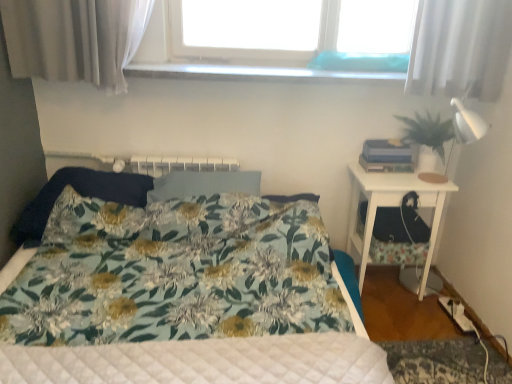
Question: Can you confirm if white glossy nightstand at right is wider than dark blue fabric pillow at left, the first pillow when ordered from left to right?

Choices:
 (A) no
 (B) yes

Answer: (A)

Question: Can you confirm if white glossy nightstand at right is taller than dark blue fabric pillow at left, which appears as the 2th pillow when viewed from the right?

Choices:
 (A) no
 (B) yes

Answer: (B)

Question: Would you say white glossy nightstand at right is a long distance from dark blue fabric pillow at left, which appears as the 2th pillow when viewed from the right?

Choices:
 (A) yes
 (B) no

Answer: (A)

Question: Can dark blue fabric pillow at left, the first pillow when ordered from left to right, be found inside white glossy nightstand at right?

Choices:
 (A) yes
 (B) no

Answer: (B)

Question: From the image's perspective, is white glossy nightstand at right below dark blue fabric pillow at left, which appears as the 2th pillow when viewed from the right?

Choices:
 (A) no
 (B) yes

Answer: (B)

Question: Is fluffy fabric pillow at center, placed as the 2th pillow when sorted from left to right, bigger or smaller than white glossy nightstand at right?

Choices:
 (A) small
 (B) big

Answer: (A)

Question: Based on their positions, is fluffy fabric pillow at center, placed as the 2th pillow when sorted from left to right, located to the left or right of white glossy nightstand at right?

Choices:
 (A) right
 (B) left

Answer: (B)

Question: From the image's perspective, is fluffy fabric pillow at center, which is the first pillow in right-to-left order, positioned above or below white glossy nightstand at right?

Choices:
 (A) above
 (B) below

Answer: (A)

Question: Is fluffy fabric pillow at center, which is the first pillow in right-to-left order, taller or shorter than white glossy nightstand at right?

Choices:
 (A) tall
 (B) short

Answer: (B)

Question: From a real-world perspective, relative to fluffy fabric pillow at center, placed as the 2th pillow when sorted from left to right, is floral fabric bed at center vertically above or below?

Choices:
 (A) above
 (B) below

Answer: (B)

Question: Considering the positions of floral fabric bed at center and fluffy fabric pillow at center, placed as the 2th pillow when sorted from left to right, in the image, is floral fabric bed at center wider or thinner than fluffy fabric pillow at center, placed as the 2th pillow when sorted from left to right,?

Choices:
 (A) wide
 (B) thin

Answer: (A)

Question: Is floral fabric bed at center inside or outside of fluffy fabric pillow at center, which is the first pillow in right-to-left order?

Choices:
 (A) outside
 (B) inside

Answer: (A)

Question: Considering their positions, is floral fabric bed at center located in front of or behind fluffy fabric pillow at center, which is the first pillow in right-to-left order?

Choices:
 (A) front
 (B) behind

Answer: (A)

Question: Which is correct: green matte plant at right is inside floral fabric bed at center, or outside of it?

Choices:
 (A) outside
 (B) inside

Answer: (A)

Question: Is green matte plant at right taller or shorter than floral fabric bed at center?

Choices:
 (A) tall
 (B) short

Answer: (B)